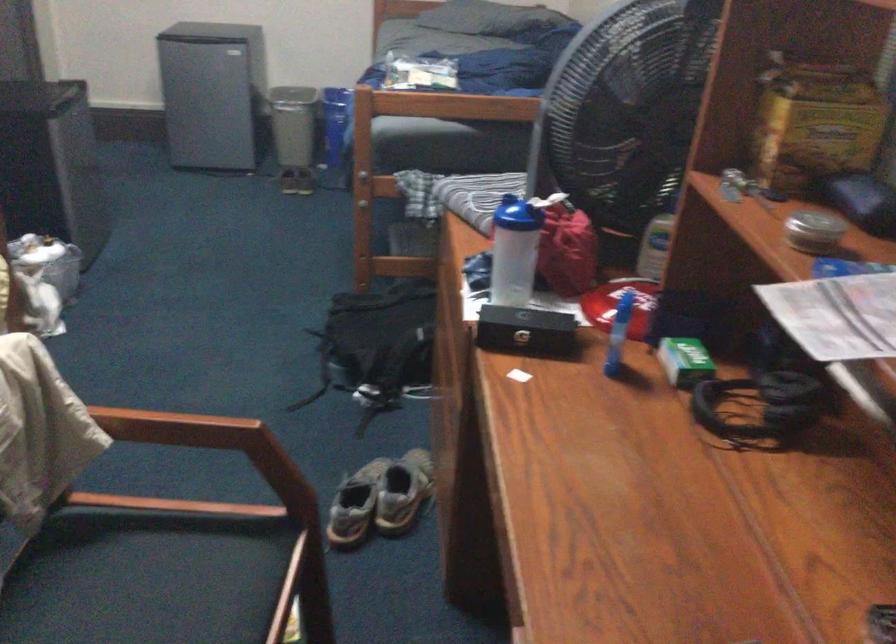
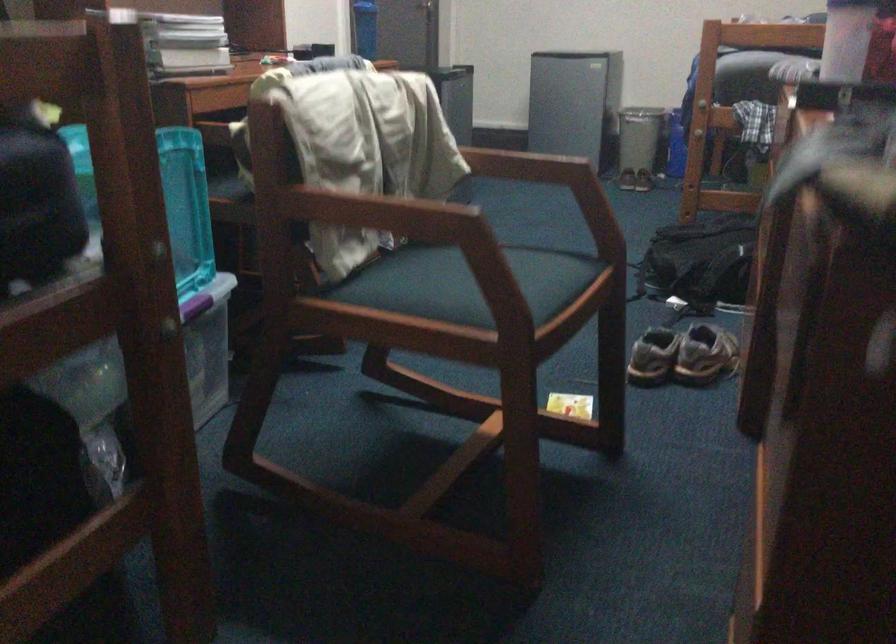
The point at (x=205, y=313) is marked in the first image. Where is the corresponding point in the second image?

(543, 242)